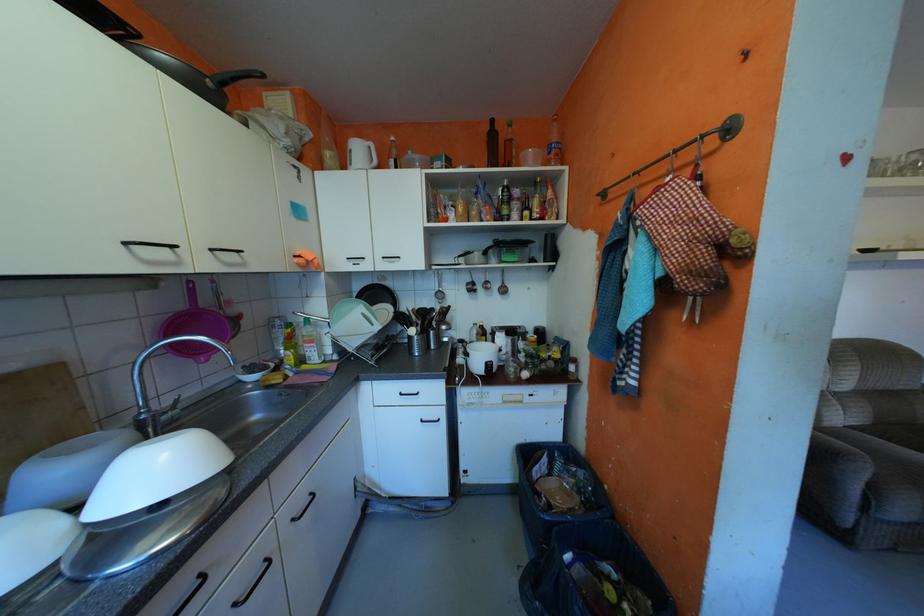
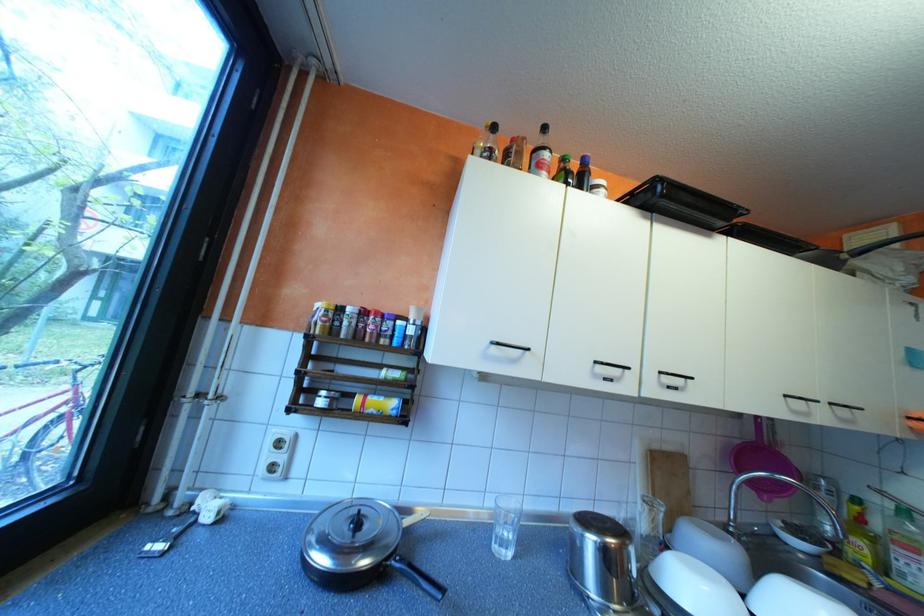
Find the pixel in the second image that matches (x=138, y=241) in the first image.

(797, 395)